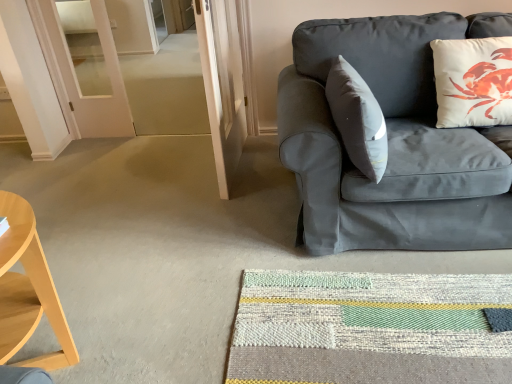
The width and height of the screenshot is (512, 384). Identify the location of vacant space that is to the left of matte gray couch at right. (190, 234).